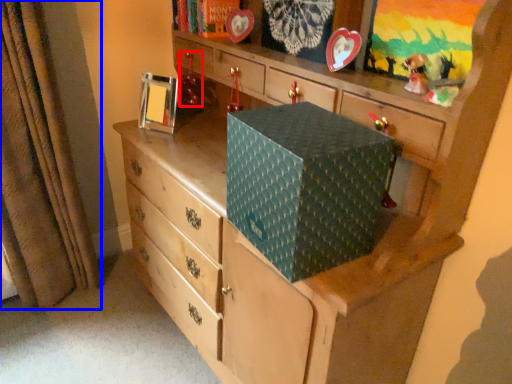
Question: Among these objects, which one is farthest to the camera, toy (highlighted by a red box) or curtain (highlighted by a blue box)?

Choices:
 (A) toy
 (B) curtain

Answer: (A)